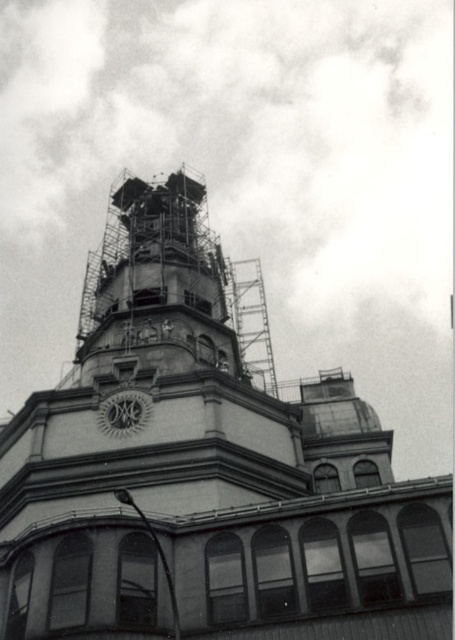
Question: Does stone scaffolding at center appear on the left side of white textured clock at center?

Choices:
 (A) no
 (B) yes

Answer: (A)

Question: Can you confirm if stone scaffolding at center is smaller than white textured clock at center?

Choices:
 (A) no
 (B) yes

Answer: (A)

Question: Is stone scaffolding at center positioned before white textured clock at center?

Choices:
 (A) no
 (B) yes

Answer: (B)

Question: Which of the following is the farthest from the observer?

Choices:
 (A) white textured clock at center
 (B) stone scaffolding at center

Answer: (A)

Question: Which point is closer to the camera?

Choices:
 (A) (106, 429)
 (B) (143, 627)

Answer: (B)